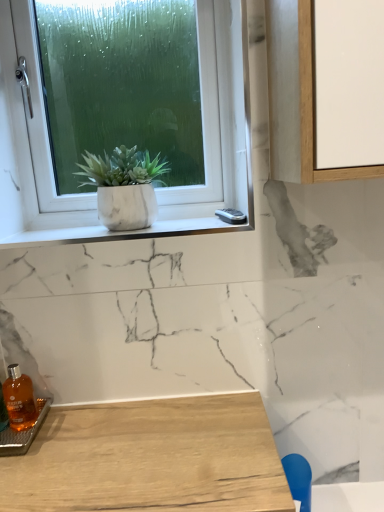
Find the location of a particular element. This screenshot has width=384, height=512. blue plastic chair at lower right is located at coordinates (298, 479).

The width and height of the screenshot is (384, 512). Identify the location of white marble window sill at upper left. (122, 232).

What is the approximate width of translucent amber glass bottle at lower left?

4.76 inches.

Find the location of `white marble pot at upper left`. white marble pot at upper left is located at coordinates (124, 187).

Where is `blue plastic chair at lower right`? blue plastic chair at lower right is located at coordinates (298, 479).

Does point (153, 236) appear closer or farther from the camera than point (9, 421)?

Point (153, 236) is positioned farther from the camera compared to point (9, 421).

This screenshot has width=384, height=512. There is a translucent amber glass bottle at lower left. Find the location of `window sill above it (from a real-world perspective)`. window sill above it (from a real-world perspective) is located at coordinates (122, 232).

Can you confirm if white marble window sill at upper left is thinner than translucent amber glass bottle at lower left?

Incorrect, the width of white marble window sill at upper left is not less than that of translucent amber glass bottle at lower left.

Measure the distance between white marble window sill at upper left and translucent amber glass bottle at lower left.

The distance of white marble window sill at upper left from translucent amber glass bottle at lower left is 15.37 inches.

Is translucent amber glass bottle at lower left to the right of white matte window at upper left from the viewer's perspective?

No.

Is white matte window at upper left completely or partially inside translucent amber glass bottle at lower left?

No, white matte window at upper left is located outside of translucent amber glass bottle at lower left.

What are the coordinates of `window on the right of the translucent amber glass bottle at lower left` in the screenshot? It's located at (133, 106).

Consider the image. From the image's perspective, does translucent amber glass bottle at lower left appear lower than white matte window at upper left?

Yes, from the image's perspective, translucent amber glass bottle at lower left is below white matte window at upper left.

From a real-world perspective, is white marble window sill at upper left on blue plastic chair at lower right?

Indeed, from a real-world perspective, white marble window sill at upper left stands above blue plastic chair at lower right.

Does white marble window sill at upper left come behind blue plastic chair at lower right?

Yes, it is behind blue plastic chair at lower right.

At what (x,y) coordinates should I click in order to perform the action: click on window sill above the blue plastic chair at lower right (from a real-world perspective). Please return your answer as a coordinate pair (x, y). Looking at the image, I should click on (122, 232).

Do you think white marble window sill at upper left is within blue plastic chair at lower right, or outside of it?

white marble window sill at upper left lies outside blue plastic chair at lower right.

Locate an element on the screen. The image size is (384, 512). chair lying below the white marble pot at upper left (from the image's perspective) is located at coordinates (298, 479).

Does point (147, 182) lie in front of point (294, 497)?

No, it is not.

Can you confirm if white marble pot at upper left is bigger than blue plastic chair at lower right?

Indeed, white marble pot at upper left has a larger size compared to blue plastic chair at lower right.

From the picture: Can you confirm if white marble pot at upper left is shorter than blue plastic chair at lower right?

No.

Would you say white matte window at upper left is a long distance from blue plastic chair at lower right?

They are positioned close to each other.

Is blue plastic chair at lower right surrounded by white matte window at upper left?

No, blue plastic chair at lower right is located outside of white matte window at upper left.

Is white matte window at upper left looking in the opposite direction of blue plastic chair at lower right?

white matte window at upper left is not turned away from blue plastic chair at lower right.

Is white matte window at upper left behind blue plastic chair at lower right?

Yes, it is.

Can we say white matte window at upper left lies outside white marble window sill at upper left?

Indeed, white matte window at upper left is completely outside white marble window sill at upper left.

Does point (77, 182) lie behind point (172, 224)?

Yes, point (77, 182) is behind point (172, 224).

Between white matte window at upper left and white marble window sill at upper left, which one has less height?

Standing shorter between the two is white marble window sill at upper left.

Which object is positioned more to the left, translucent amber glass bottle at lower left or white marble window sill at upper left?

From the viewer's perspective, translucent amber glass bottle at lower left appears more on the left side.

Can you tell me how much translucent amber glass bottle at lower left and white marble window sill at upper left differ in facing direction?

There is a 0.000973-degree angle between the facing directions of translucent amber glass bottle at lower left and white marble window sill at upper left.

Image resolution: width=384 pixels, height=512 pixels. In order to click on window sill behind the translucent amber glass bottle at lower left in this screenshot , I will do `click(122, 232)`.

Is translucent amber glass bottle at lower left inside the boundaries of white marble window sill at upper left, or outside?

translucent amber glass bottle at lower left is spatially situated outside white marble window sill at upper left.

This screenshot has height=512, width=384. Find the location of `bottle in front of the white marble window sill at upper left`. bottle in front of the white marble window sill at upper left is located at coordinates click(19, 399).

At what (x,y) coordinates should I click in order to perform the action: click on bottle that appears below the white matte window at upper left (from a real-world perspective). Please return your answer as a coordinate pair (x, y). The width and height of the screenshot is (384, 512). Looking at the image, I should click on (19, 399).

Based on the photo, considering their positions, is white marble pot at upper left positioned further to white matte window at upper left than blue plastic chair at lower right?

Based on the image, blue plastic chair at lower right appears to be further to white matte window at upper left.

In the scene shown: Based on their spatial positions, is white marble pot at upper left or white marble window sill at upper left further from white matte window at upper left?

white marble window sill at upper left lies further to white matte window at upper left than the other object.

Estimate the real-world distances between objects in this image. Which object is further from white matte window at upper left, blue plastic chair at lower right or white marble pot at upper left?

Among the two, blue plastic chair at lower right is located further to white matte window at upper left.

Which object lies nearer to the anchor point translucent amber glass bottle at lower left, white matte window at upper left or white marble window sill at upper left?

Based on the image, white marble window sill at upper left appears to be nearer to translucent amber glass bottle at lower left.

Which object lies further to the anchor point white marble pot at upper left, white matte window at upper left or white marble window sill at upper left?

Based on the image, white matte window at upper left appears to be further to white marble pot at upper left.

From the image, which object appears to be farther from white matte window at upper left, white marble pot at upper left or translucent amber glass bottle at lower left?

translucent amber glass bottle at lower left is further to white matte window at upper left.

Which object lies further to the anchor point white marble window sill at upper left, blue plastic chair at lower right or translucent amber glass bottle at lower left?

The object further to white marble window sill at upper left is blue plastic chair at lower right.

Looking at the image, which one is located further to blue plastic chair at lower right, white marble pot at upper left or white marble window sill at upper left?

white marble pot at upper left is positioned further to the anchor blue plastic chair at lower right.

Locate an element on the screen. The width and height of the screenshot is (384, 512). bottle between white marble window sill at upper left and blue plastic chair at lower right in the vertical direction is located at coordinates (19, 399).

This screenshot has width=384, height=512. Identify the location of bottle between white matte window at upper left and blue plastic chair at lower right from top to bottom. (19, 399).

Where is `window sill between white marble pot at upper left and blue plastic chair at lower right from top to bottom`? window sill between white marble pot at upper left and blue plastic chair at lower right from top to bottom is located at coordinates (122, 232).

Locate an element on the screen. The width and height of the screenshot is (384, 512). bottle between white marble pot at upper left and blue plastic chair at lower right from top to bottom is located at coordinates (19, 399).